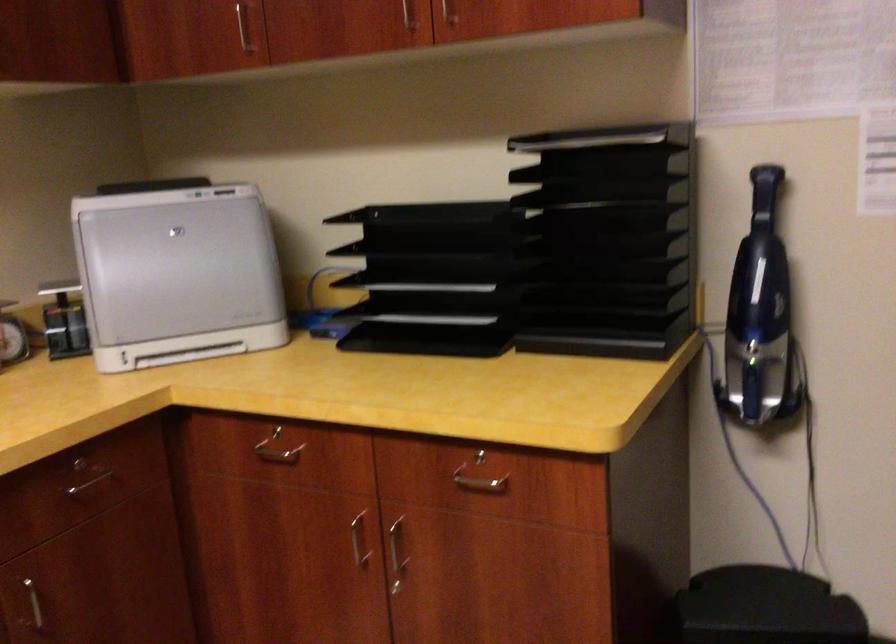
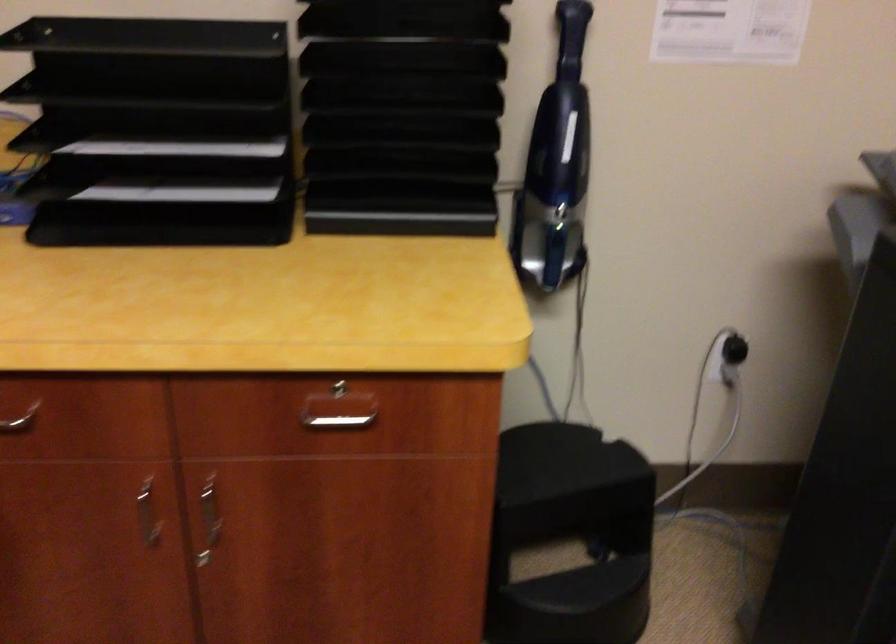
Locate, in the second image, the point that corresponds to point (444, 286) in the first image.

(177, 145)